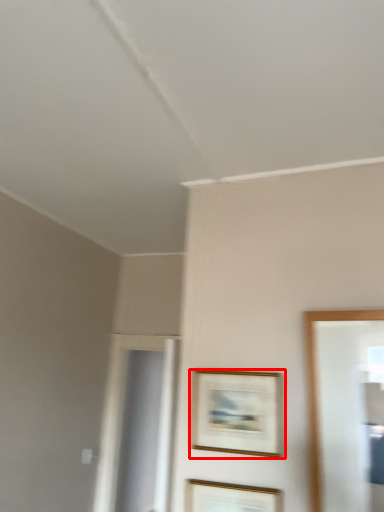
Question: From the image, what is the correct spatial relationship of picture frame (annotated by the red box) in relation to picture frame?

Choices:
 (A) left
 (B) right

Answer: (B)